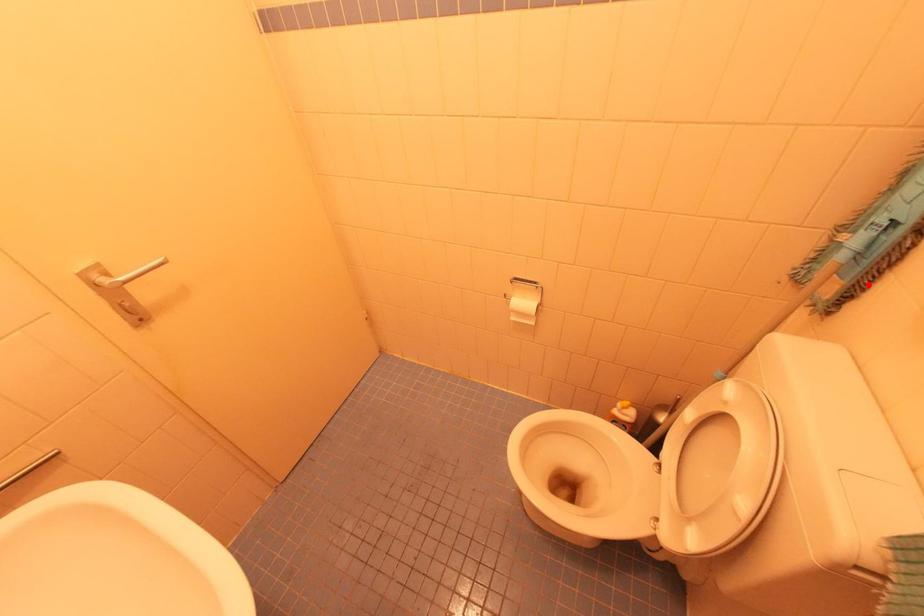
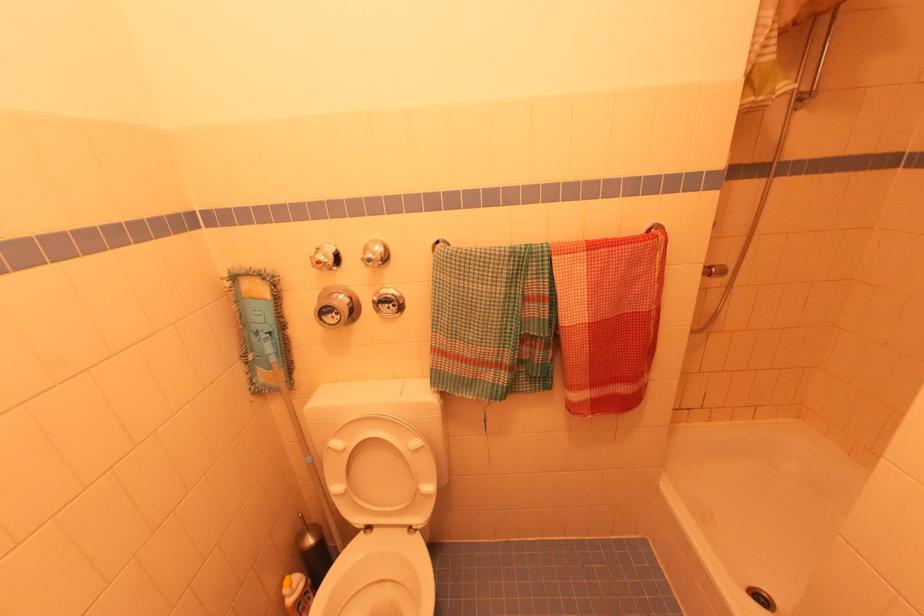
The point at the highlighted location is marked in the first image. Where is the corresponding point in the second image?

(293, 361)